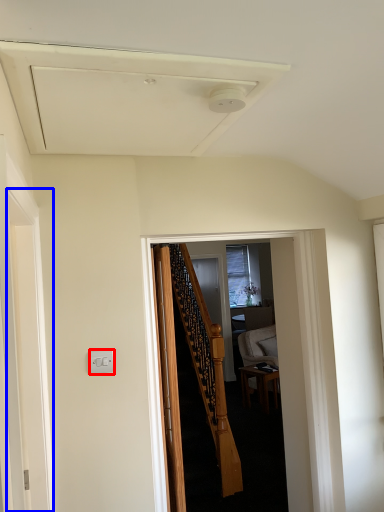
Question: Which of the following is the closest to the observer, electric outlet (highlighted by a red box) or screen door (highlighted by a blue box)?

Choices:
 (A) electric outlet
 (B) screen door

Answer: (B)